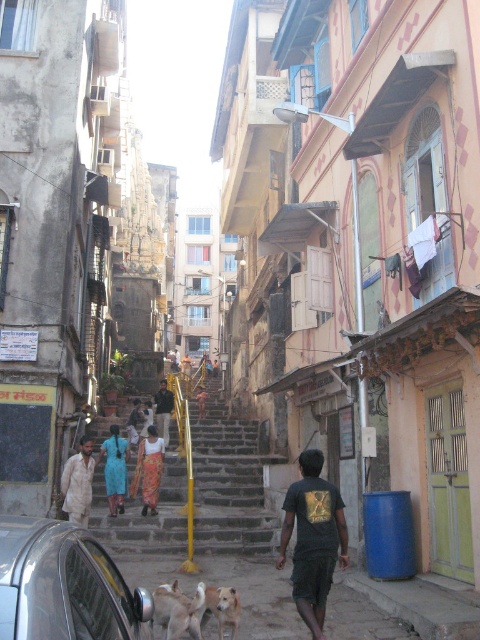
From the picture: You are a delivery person needing to park your vehicle in this area. The shiny chrome car at lower left is blocking the entrance to the parking lot. Can you maneuver around it using the space next to the dark blue fabric at center?

The shiny chrome car at lower left is wider than the dark blue fabric at center. Since the car is wider, the space next to the dark blue fabric at center may not be sufficient to maneuver around the car. You might need to look for an alternative path or wait for the car to move.

You are standing at the bottom of the staircase and want to reach the top. There are two points marked on the staircase. One is point (98,579) and the other is point (166,426). Which point should you step on first as you begin climbing the staircase?

You should step on point (98,579) first because it is closer to you than point (166,426), so it will be the first step you encounter as you start climbing.

You are a photographer trying to capture a photo of the white fur dog at center and the orange printed sari at center in the same frame. Since the camera has a fixed focus, you need to know which object is narrower to ensure proper framing. Which one is narrower?

The white fur dog at center is narrower than the orange printed sari at center.